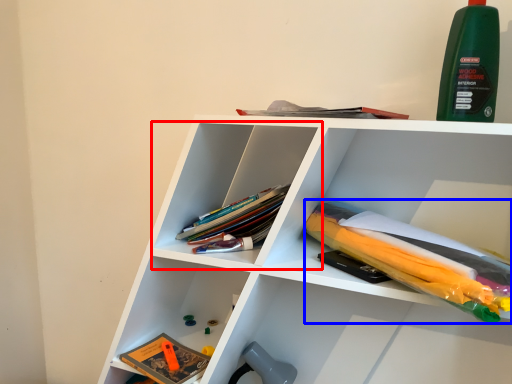
Question: Which object appears farthest to the camera in this image, cabinet (highlighted by a red box) or book (highlighted by a blue box)?

Choices:
 (A) cabinet
 (B) book

Answer: (A)